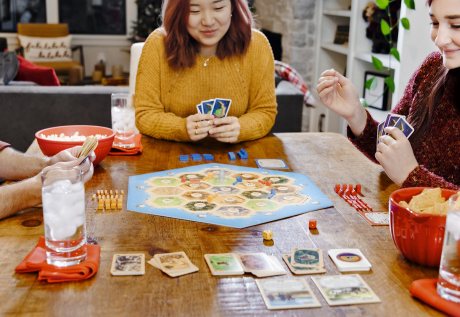
You are a GUI agent. You are given a task and a screenshot of the screen. Output one action in this format:
    pyautogui.click(x=<x>, y=<y>)
    Task: Click on the board game
    The image size is (460, 317).
    Given the screenshot: What is the action you would take?
    pyautogui.click(x=217, y=181), pyautogui.click(x=184, y=181), pyautogui.click(x=195, y=200), pyautogui.click(x=226, y=201), pyautogui.click(x=251, y=187)